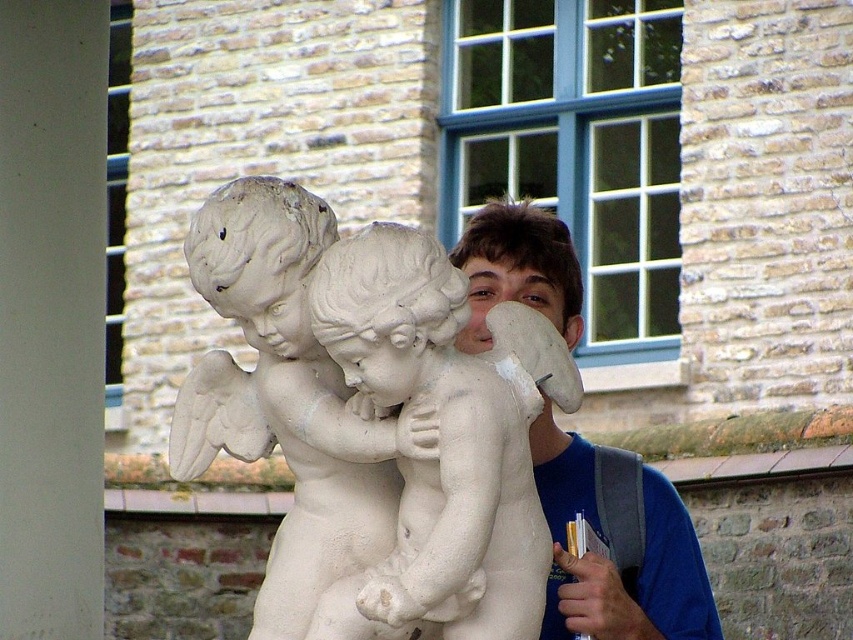
Between white stone cherubs at center and blue matte shirt at center, which one has more height?

Standing taller between the two is blue matte shirt at center.

Find the location of `white stone cherubs at center`. white stone cherubs at center is located at coordinates 285,397.

This screenshot has width=853, height=640. Find the location of `white stone cherubs at center`. white stone cherubs at center is located at coordinates (285, 397).